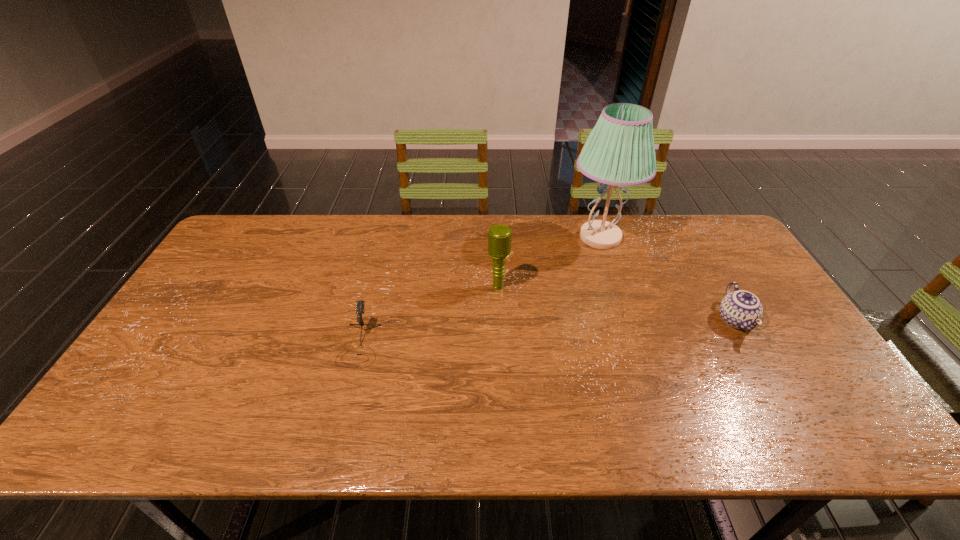
Locate an element on the screen. Image resolution: width=960 pixels, height=540 pixels. free spot located on the stand of the nearer microphone is located at coordinates (347, 395).

Image resolution: width=960 pixels, height=540 pixels. I want to click on object located at the far edge, so click(619, 151).

Where is `object located at the right edge`? The width and height of the screenshot is (960, 540). object located at the right edge is located at coordinates (741, 309).

The image size is (960, 540). In the image, there is a desktop. What are the coordinates of `vacant space at the far edge` in the screenshot? It's located at (430, 220).

Identify the location of free space at the near edge. (263, 418).

Identify the location of free location at the left edge of the desktop. This screenshot has width=960, height=540. (187, 323).

Identify the location of vacant space at the right edge of the desktop. (799, 335).

The image size is (960, 540). What are the coordinates of `free space at the far right corner of the desktop` in the screenshot? It's located at (x=690, y=236).

You are a GUI agent. You are given a task and a screenshot of the screen. Output one action in this format:
    pyautogui.click(x=<x>, y=<y>)
    Task: Click on the vacant area between the third shortest object and the shorter microphone
    
    Given the screenshot: What is the action you would take?
    pos(429,315)

This screenshot has width=960, height=540. Find the location of `vacant space in between the tallest object and the leftmost object`. vacant space in between the tallest object and the leftmost object is located at coordinates (480, 291).